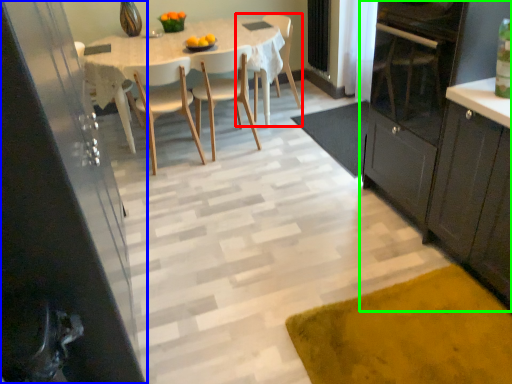
Question: Based on their relative distances, which object is nearer to chair (highlighted by a red box)? Choose from cabinetry (highlighted by a blue box) and cabinetry (highlighted by a green box).

Choices:
 (A) cabinetry
 (B) cabinetry

Answer: (B)